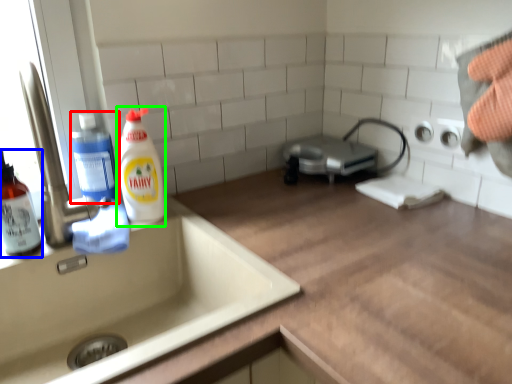
Question: Considering the real-world distances, which object is farthest from cleaning product (highlighted by a red box)? cleaning product (highlighted by a blue box) or cleaning product (highlighted by a green box)?

Choices:
 (A) cleaning product
 (B) cleaning product

Answer: (A)